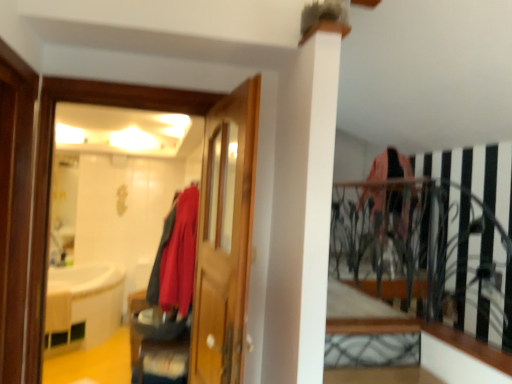
Question: Can we say white wood ledge at lower right lies outside matte red coat at center?

Choices:
 (A) yes
 (B) no

Answer: (A)

Question: Considering the relative sizes of white wood ledge at lower right and matte red coat at center in the image provided, is white wood ledge at lower right thinner than matte red coat at center?

Choices:
 (A) no
 (B) yes

Answer: (A)

Question: Can you confirm if white wood ledge at lower right is positioned to the right of matte red coat at center?

Choices:
 (A) yes
 (B) no

Answer: (A)

Question: Can you confirm if white wood ledge at lower right is wider than matte red coat at center?

Choices:
 (A) no
 (B) yes

Answer: (B)

Question: Is white wood ledge at lower right to the left of matte red coat at center from the viewer's perspective?

Choices:
 (A) no
 (B) yes

Answer: (A)

Question: From the image's perspective, is white wood ledge at lower right located beneath matte red coat at center?

Choices:
 (A) yes
 (B) no

Answer: (A)

Question: From the image's perspective, does brushed metal shoe at lower center appear lower than matte red coat at center?

Choices:
 (A) yes
 (B) no

Answer: (A)

Question: Is brushed metal shoe at lower center further to the viewer compared to matte red coat at center?

Choices:
 (A) yes
 (B) no

Answer: (B)

Question: Is brushed metal shoe at lower center oriented towards matte red coat at center?

Choices:
 (A) no
 (B) yes

Answer: (A)

Question: Is brushed metal shoe at lower center thinner than matte red coat at center?

Choices:
 (A) no
 (B) yes

Answer: (A)

Question: Considering the relative positions of brushed metal shoe at lower center and matte red coat at center in the image provided, is brushed metal shoe at lower center to the right of matte red coat at center from the viewer's perspective?

Choices:
 (A) no
 (B) yes

Answer: (A)

Question: From the image's perspective, is brushed metal shoe at lower center on top of matte red coat at center?

Choices:
 (A) yes
 (B) no

Answer: (B)

Question: Can you confirm if brushed metal shoe at lower center is wider than wooden door at center?

Choices:
 (A) no
 (B) yes

Answer: (B)